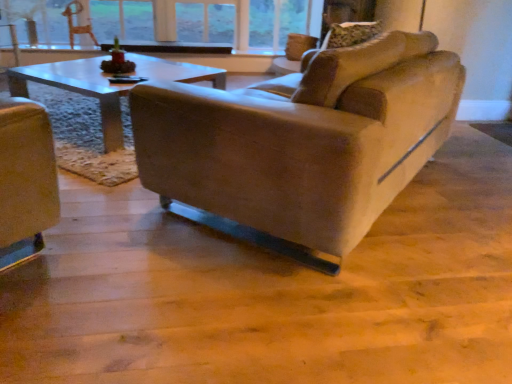
The width and height of the screenshot is (512, 384). Describe the element at coordinates (204, 21) in the screenshot. I see `clear glass window at upper center` at that location.

This screenshot has width=512, height=384. What do you see at coordinates (77, 26) in the screenshot?
I see `wooden textured swivel chair at upper left` at bounding box center [77, 26].

The height and width of the screenshot is (384, 512). I want to click on clear glass window at upper center, so click(204, 21).

From the image's perspective, would you say suede-like beige couch at center is shown under wooden textured swivel chair at upper left?

Correct, suede-like beige couch at center appears lower than wooden textured swivel chair at upper left in the image.

Is suede-like beige couch at center next to wooden textured swivel chair at upper left?

No, suede-like beige couch at center is not in contact with wooden textured swivel chair at upper left.

Is suede-like beige couch at center positioned with its back to wooden textured swivel chair at upper left?

No, suede-like beige couch at center is not facing away from wooden textured swivel chair at upper left.

From the picture: Is suede-like beige couch at center taller or shorter than wooden textured swivel chair at upper left?

In the image, suede-like beige couch at center appears to be taller than wooden textured swivel chair at upper left.

Considering the relative positions of suede-like beige couch at center and clear glass window at upper center in the image provided, is suede-like beige couch at center to the left or to the right of clear glass window at upper center?

suede-like beige couch at center is positioned on clear glass window at upper center's right side.

Would you say clear glass window at upper center is part of suede-like beige couch at center's contents?

No, clear glass window at upper center is located outside of suede-like beige couch at center.

Can you tell me how much suede-like beige couch at center and clear glass window at upper center differ in facing direction?

The facing directions of suede-like beige couch at center and clear glass window at upper center are 129 degrees apart.

In terms of width, does suede-like beige couch at center look wider or thinner when compared to clear glass window at upper center?

Considering their sizes, suede-like beige couch at center looks broader than clear glass window at upper center.

Considering the relative sizes of clear glass window at upper center and wooden textured swivel chair at upper left in the image provided, is clear glass window at upper center shorter than wooden textured swivel chair at upper left?

No.

Are clear glass window at upper center and wooden textured swivel chair at upper left beside each other?

clear glass window at upper center and wooden textured swivel chair at upper left are not in contact.

Considering the sizes of objects clear glass window at upper center and wooden textured swivel chair at upper left in the image provided, who is bigger, clear glass window at upper center or wooden textured swivel chair at upper left?

clear glass window at upper center is bigger.

Considering the relative sizes of clear glass window at upper center and wooden textured swivel chair at upper left in the image provided, is clear glass window at upper center thinner than wooden textured swivel chair at upper left?

In fact, clear glass window at upper center might be wider than wooden textured swivel chair at upper left.

Does clear glass window at upper center lie in front of suede-like beige couch at center?

No, clear glass window at upper center is further to the viewer.

Between point (256, 43) and point (302, 192), which one is positioned in front?

Positioned in front is point (302, 192).

Where is `studio couch located underneath the clear glass window at upper center (from a real-world perspective)`? studio couch located underneath the clear glass window at upper center (from a real-world perspective) is located at coordinates (300, 144).

Does clear glass window at upper center turn towards suede-like beige couch at center?

Yes, clear glass window at upper center is oriented towards suede-like beige couch at center.

Between point (71, 46) and point (298, 2), which one is positioned in front?

Point (298, 2)

Identify the location of swivel chair below the clear glass window at upper center (from the image's perspective). (x=77, y=26).

Would you say wooden textured swivel chair at upper left is inside or outside clear glass window at upper center?

wooden textured swivel chair at upper left is not inside clear glass window at upper center, it's outside.

Considering the sizes of objects wooden textured swivel chair at upper left and clear glass window at upper center in the image provided, who is wider, wooden textured swivel chair at upper left or clear glass window at upper center?

Wider between the two is clear glass window at upper center.

From the picture: Considering the relative positions of wooden textured swivel chair at upper left and suede-like beige couch at center in the image provided, is wooden textured swivel chair at upper left to the left or to the right of suede-like beige couch at center?

In the image, wooden textured swivel chair at upper left appears on the left side of suede-like beige couch at center.

Considering the relative sizes of wooden textured swivel chair at upper left and suede-like beige couch at center in the image provided, is wooden textured swivel chair at upper left wider than suede-like beige couch at center?

No.

How different are the orientations of wooden textured swivel chair at upper left and suede-like beige couch at center in degrees?

They differ by 154 degrees in their facing directions.

Looking at this image, does wooden textured swivel chair at upper left have a lesser height compared to suede-like beige couch at center?

Correct, wooden textured swivel chair at upper left is not as tall as suede-like beige couch at center.

At what (x,y) coordinates should I click in order to perform the action: click on studio couch lying on the right of wooden textured swivel chair at upper left. Please return your answer as a coordinate pair (x, y). The width and height of the screenshot is (512, 384). Looking at the image, I should click on (300, 144).

This screenshot has height=384, width=512. In order to click on studio couch that appears below the clear glass window at upper center (from the image's perspective) in this screenshot , I will do `click(300, 144)`.

When comparing their distances from wooden textured swivel chair at upper left, does clear glass window at upper center or suede-like beige couch at center seem further?

Based on the image, suede-like beige couch at center appears to be further to wooden textured swivel chair at upper left.

Based on their spatial positions, is clear glass window at upper center or wooden textured swivel chair at upper left closer to suede-like beige couch at center?

clear glass window at upper center.

When comparing their distances from wooden textured swivel chair at upper left, does suede-like beige couch at center or clear glass window at upper center seem closer?

clear glass window at upper center.

Estimate the real-world distances between objects in this image. Which object is further from suede-like beige couch at center, wooden textured swivel chair at upper left or clear glass window at upper center?

Based on the image, wooden textured swivel chair at upper left appears to be further to suede-like beige couch at center.

Looking at the image, which one is located further to clear glass window at upper center, wooden textured swivel chair at upper left or suede-like beige couch at center?

suede-like beige couch at center lies further to clear glass window at upper center than the other object.

Estimate the real-world distances between objects in this image. Which object is further from clear glass window at upper center, suede-like beige couch at center or wooden textured swivel chair at upper left?

The object further to clear glass window at upper center is suede-like beige couch at center.

In order to click on swivel chair between suede-like beige couch at center and clear glass window at upper center in the front-back direction in this screenshot , I will do 77,26.